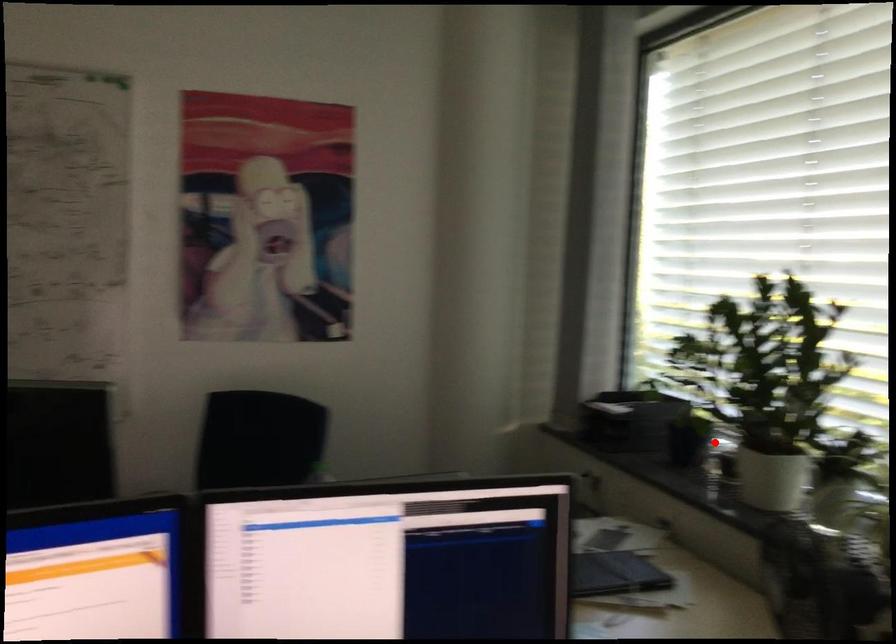
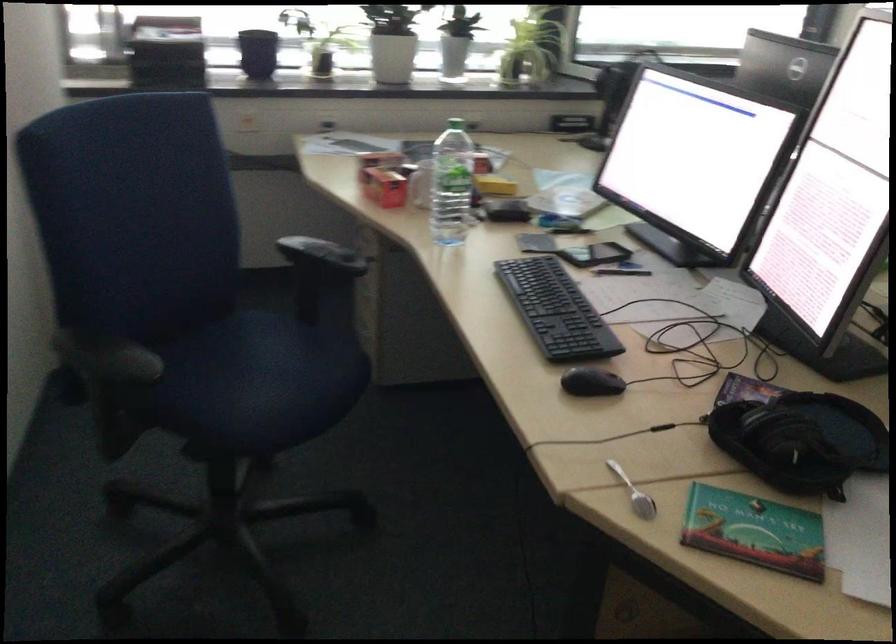
Question: I am providing you with two images of the same scene from different viewpoints. Given a red point in image1, look at the same physical point in image2. Is it:

Choices:
 (A) Closer to the viewpoint
 (B) Farther from the viewpoint

Answer: (B)